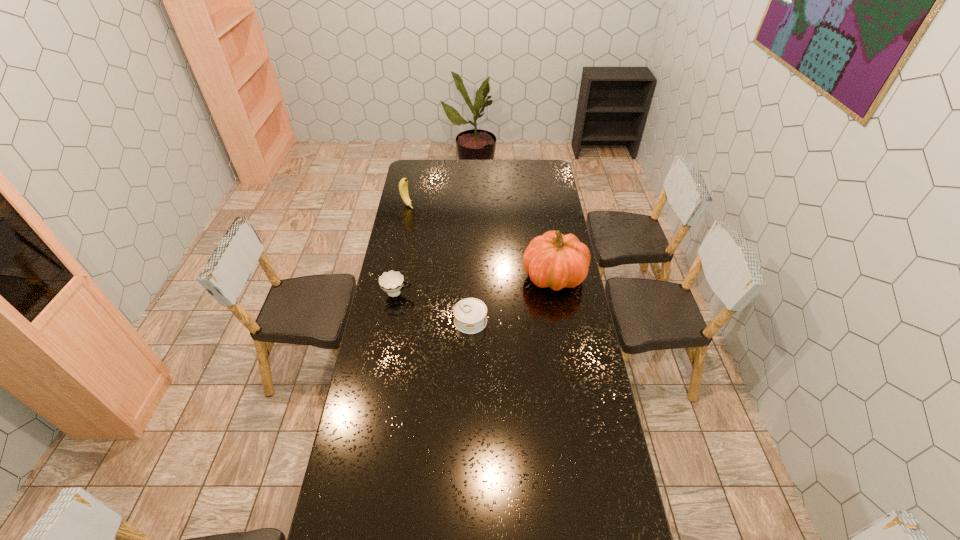
Locate an element on the screen. This screenshot has width=960, height=540. free space between the second tallest object and the tallest object is located at coordinates (481, 241).

Locate an element on the screen. This screenshot has width=960, height=540. free area in between the shortest object and the rightmost object is located at coordinates (513, 299).

At what (x,y) coordinates should I click in order to perform the action: click on free space between the can and the third tallest object. Please return your answer as a coordinate pair (x, y). Looking at the image, I should click on (434, 307).

Locate an element on the screen. This screenshot has width=960, height=540. object that is the third closest to the second object from right to left is located at coordinates (403, 184).

I want to click on object that is the second closest to the tallest object, so click(x=392, y=282).

Identify the location of free region that satisfies the following two spatial constraints: 1. on the front side of the farthest object; 2. on the right side of the second object from right to left. This screenshot has width=960, height=540. (385, 321).